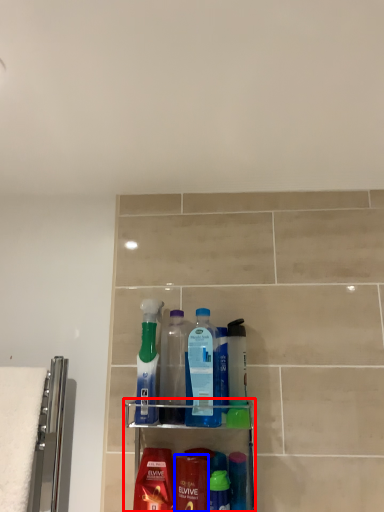
Question: Which object appears farthest to the camera in this image, shelf (highlighted by a red box) or cleaning product (highlighted by a blue box)?

Choices:
 (A) shelf
 (B) cleaning product

Answer: (B)